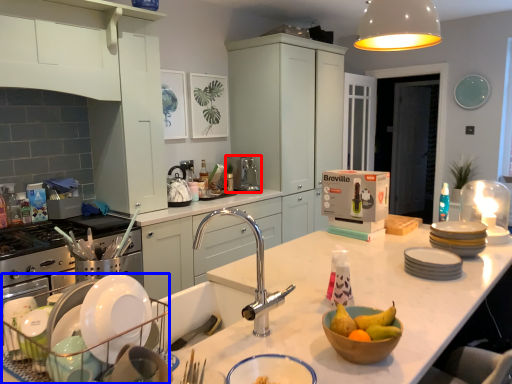
Question: Which of the following is the farthest to the observer, kitchen appliance (highlighted by a red box) or appliance (highlighted by a blue box)?

Choices:
 (A) kitchen appliance
 (B) appliance

Answer: (A)